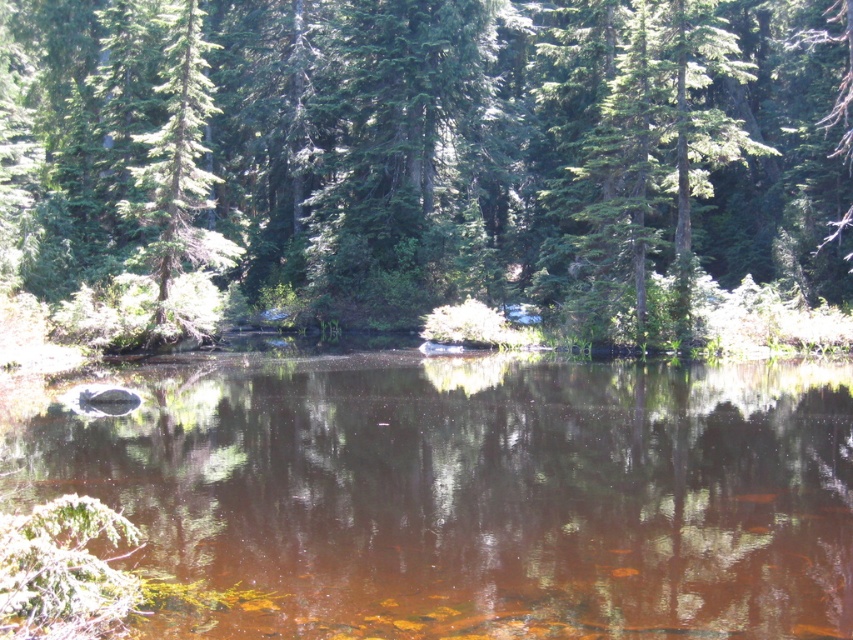
Does point (486, 93) come farther from viewer compared to point (141, 179)?

Yes, point (486, 93) is behind point (141, 179).

Can you confirm if green matte tree at center is positioned above green matte tree at left?

Yes, green matte tree at center is above green matte tree at left.

Between point (505, 189) and point (170, 68), which one is positioned behind?

The point (505, 189) is behind.

Find the location of a particular element. green matte tree at center is located at coordinates (428, 154).

What do you see at coordinates (474, 496) in the screenshot? I see `brown reflective water at center` at bounding box center [474, 496].

Where is `brown reflective water at center`? The height and width of the screenshot is (640, 853). brown reflective water at center is located at coordinates (474, 496).

Between green matte tree at center and brown reflective water at center, which one is positioned lower?

brown reflective water at center is below.

Does point (602, 244) come farther from viewer compared to point (134, 561)?

Yes, point (602, 244) is behind point (134, 561).

Identify the location of green matte tree at center. The height and width of the screenshot is (640, 853). (428, 154).

This screenshot has height=640, width=853. Identify the location of green matte tree at center. (428, 154).